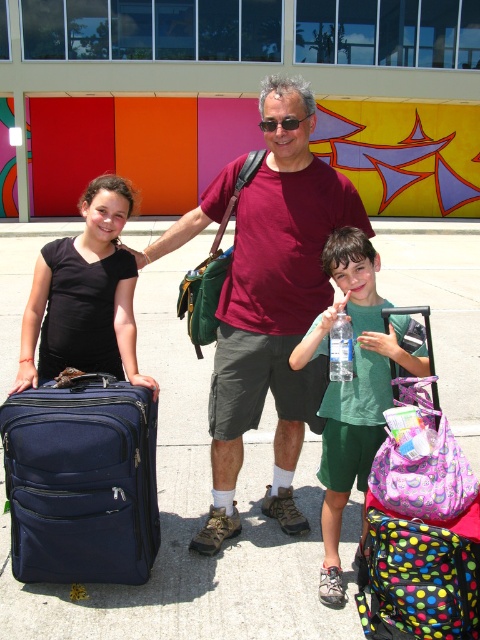
You are a photographer trying to capture a clear shot of both the green fabric water bottle at center and the clear plastic bottle at center. Since you want to focus on the one closer to you, which bottle should you prioritize in your composition?

The green fabric water bottle at center is closer to the viewer than the clear plastic bottle at center, so prioritize the green fabric water bottle at center in your composition.

You are a travel agent helping a family pack their luggage. They have two suitcases, the navy blue fabric suitcase at left and the black matte suitcase at left. The airline requires that the distance between the two suitcases must be at least 20 inches to prevent them from being separated during transit. Do you think their current arrangement meets this requirement?

The navy blue fabric suitcase at left and the black matte suitcase at left are 19.95 inches apart, which is less than the required 20 inches. Therefore, their current arrangement does not meet the airline requirement.

You are standing at the camera position and want to grab the green fabric water bottle at center. Is it within your immediate reach without moving your feet?

The green fabric water bottle at center is 8.02 feet away from the camera, which is beyond typical immediate reach without moving, so you would need to step forward to grab it.